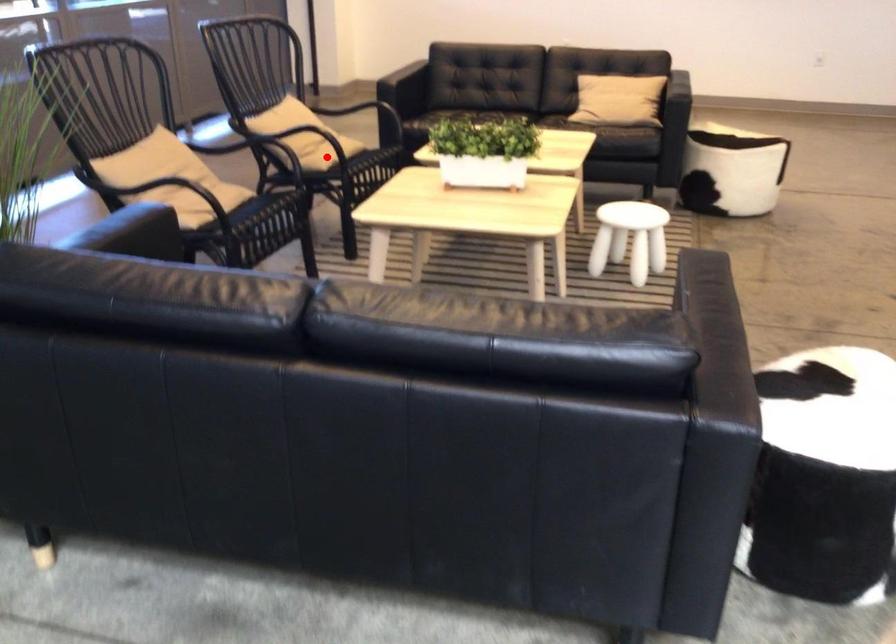
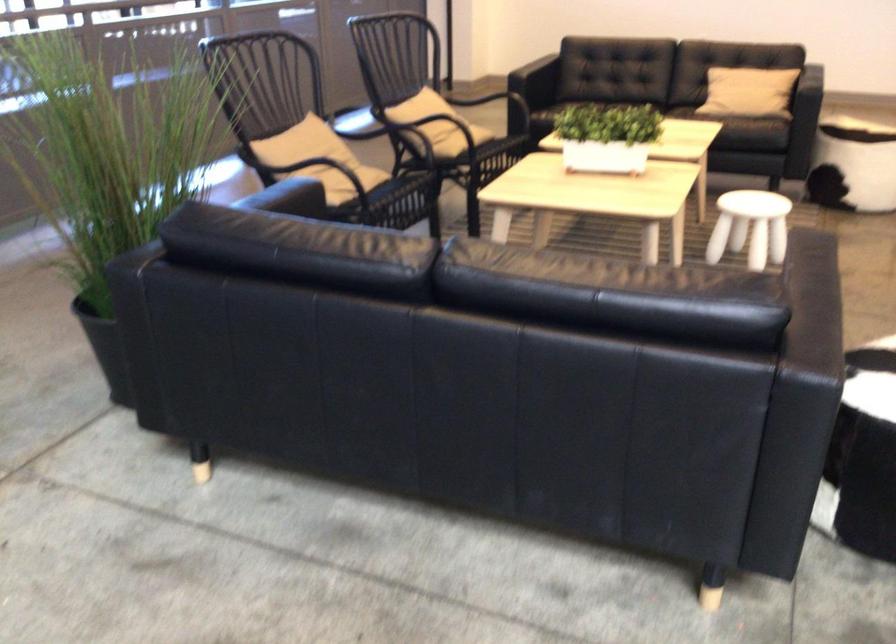
Where in the second image is the point corresponding to the highlighted location from the first image?

(462, 140)